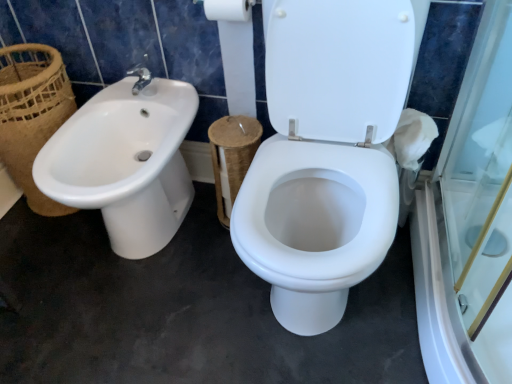
Question: Can you confirm if brown woven basket at left is thinner than white glossy sink at left?

Choices:
 (A) yes
 (B) no

Answer: (A)

Question: Is brown woven basket at left facing away from white glossy sink at left?

Choices:
 (A) no
 (B) yes

Answer: (A)

Question: Is there a large distance between brown woven basket at left and white glossy sink at left?

Choices:
 (A) no
 (B) yes

Answer: (A)

Question: Does brown woven basket at left have a larger size compared to white glossy sink at left?

Choices:
 (A) yes
 (B) no

Answer: (B)

Question: Is brown woven basket at left with white glossy sink at left?

Choices:
 (A) no
 (B) yes

Answer: (A)

Question: In the image, is white cardboard toilet paper at upper center positioned in front of or behind brown woven basket at left?

Choices:
 (A) behind
 (B) front

Answer: (B)

Question: Considering the positions of white cardboard toilet paper at upper center and brown woven basket at left in the image, is white cardboard toilet paper at upper center taller or shorter than brown woven basket at left?

Choices:
 (A) short
 (B) tall

Answer: (A)

Question: From a real-world perspective, is white cardboard toilet paper at upper center positioned above or below brown woven basket at left?

Choices:
 (A) below
 (B) above

Answer: (B)

Question: Considering the positions of white cardboard toilet paper at upper center and brown woven basket at left in the image, is white cardboard toilet paper at upper center wider or thinner than brown woven basket at left?

Choices:
 (A) wide
 (B) thin

Answer: (B)

Question: Considering the positions of brown woven basket at left and white glossy sink at left in the image, is brown woven basket at left bigger or smaller than white glossy sink at left?

Choices:
 (A) big
 (B) small

Answer: (B)

Question: Relative to white glossy sink at left, is brown woven basket at left in front or behind?

Choices:
 (A) front
 (B) behind

Answer: (B)

Question: Is brown woven basket at left to the left or to the right of white glossy sink at left in the image?

Choices:
 (A) right
 (B) left

Answer: (B)

Question: Considering the positions of brown woven basket at left and white glossy sink at left in the image, is brown woven basket at left taller or shorter than white glossy sink at left?

Choices:
 (A) tall
 (B) short

Answer: (A)

Question: Is white cardboard toilet paper at upper center wider or thinner than white glossy sink at left?

Choices:
 (A) wide
 (B) thin

Answer: (B)

Question: From the image's perspective, relative to white glossy sink at left, is white cardboard toilet paper at upper center above or below?

Choices:
 (A) above
 (B) below

Answer: (A)